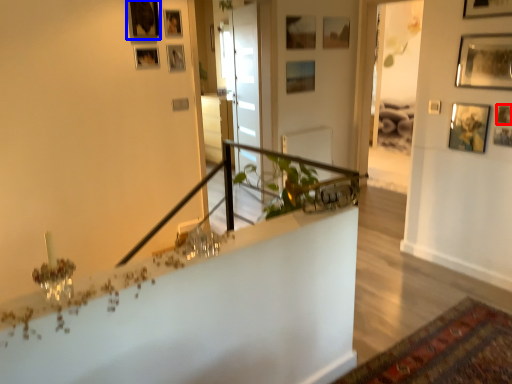
Question: Which of the following is the farthest to the observer, picture frame (highlighted by a red box) or picture frame (highlighted by a blue box)?

Choices:
 (A) picture frame
 (B) picture frame

Answer: (B)